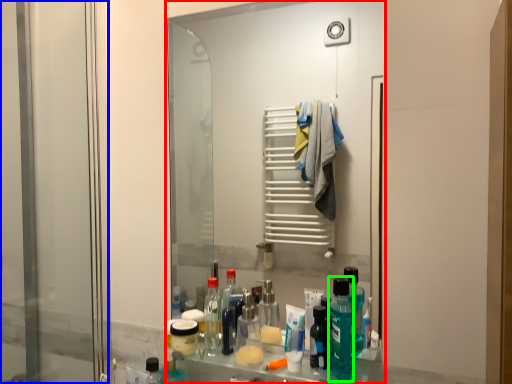
Question: Which is nearer to the mirror (highlighted by a red box)? screen door (highlighted by a blue box) or cleaning product (highlighted by a green box).

Choices:
 (A) screen door
 (B) cleaning product

Answer: (A)